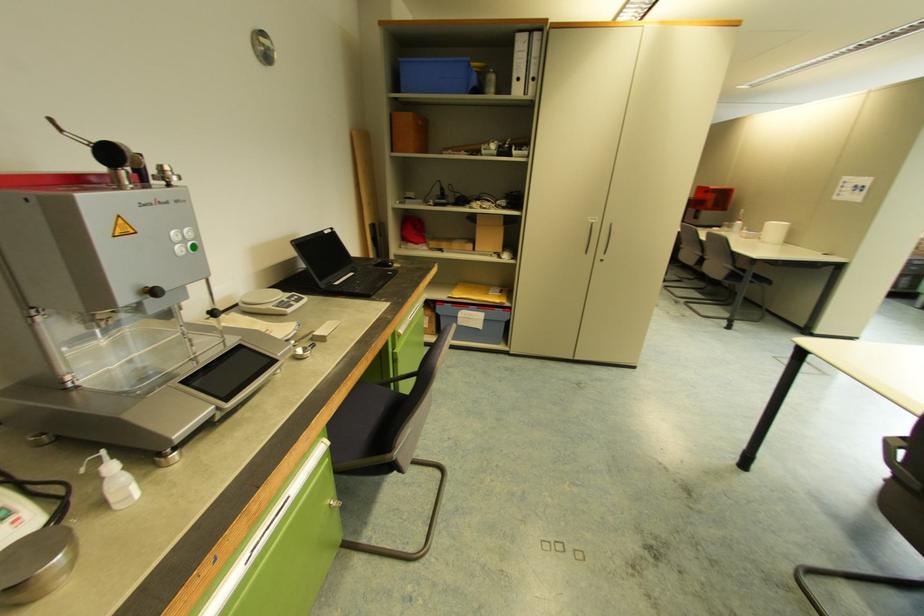
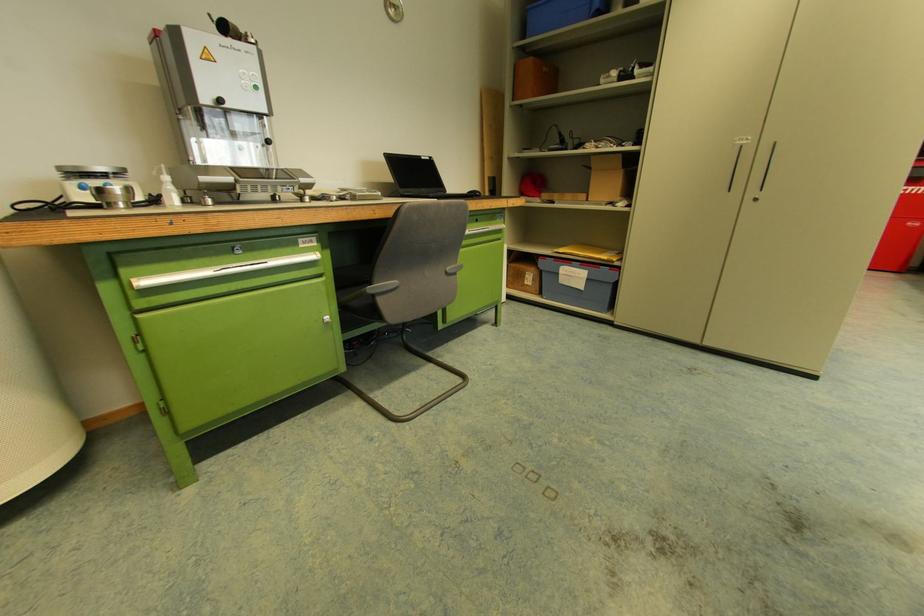
Question: How did the camera likely rotate?

Choices:
 (A) Left
 (B) Right
 (C) Up
 (D) Down

Answer: (A)